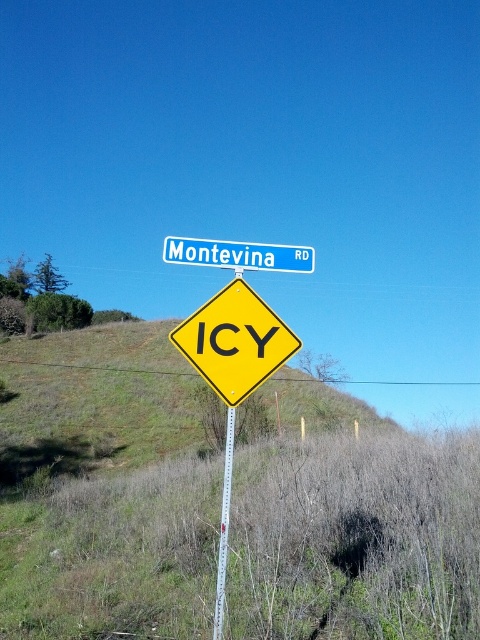
Is yellow diamond-shaped warning sign at center below blue metallic street sign at upper center?

Yes.

Which is more to the left, yellow diamond-shaped warning sign at center or blue metallic street sign at upper center?

Positioned to the left is blue metallic street sign at upper center.

Measure the distance between point [257,346] and camera.

Point [257,346] is 15.42 feet from camera.

Where is `yellow diamond-shaped warning sign at center`? Image resolution: width=480 pixels, height=640 pixels. yellow diamond-shaped warning sign at center is located at coordinates click(235, 340).

What do you see at coordinates (357, 538) in the screenshot? This screenshot has height=640, width=480. I see `dry grass at center` at bounding box center [357, 538].

Can you confirm if dry grass at center is positioned below yellow diamond-shaped warning sign at center?

Indeed, dry grass at center is positioned under yellow diamond-shaped warning sign at center.

Locate an element on the screen. The image size is (480, 640). dry grass at center is located at coordinates (357, 538).

Where is `dry grass at center`? dry grass at center is located at coordinates (357, 538).

Between point (393, 609) and point (205, 262), which one is positioned behind?

Point (393, 609)

Can you confirm if dry grass at center is smaller than blue metallic street sign at upper center?

No.

Is point (320, 474) closer to camera compared to point (165, 246)?

No, it is not.

Where is `dry grass at center`? The image size is (480, 640). dry grass at center is located at coordinates (357, 538).